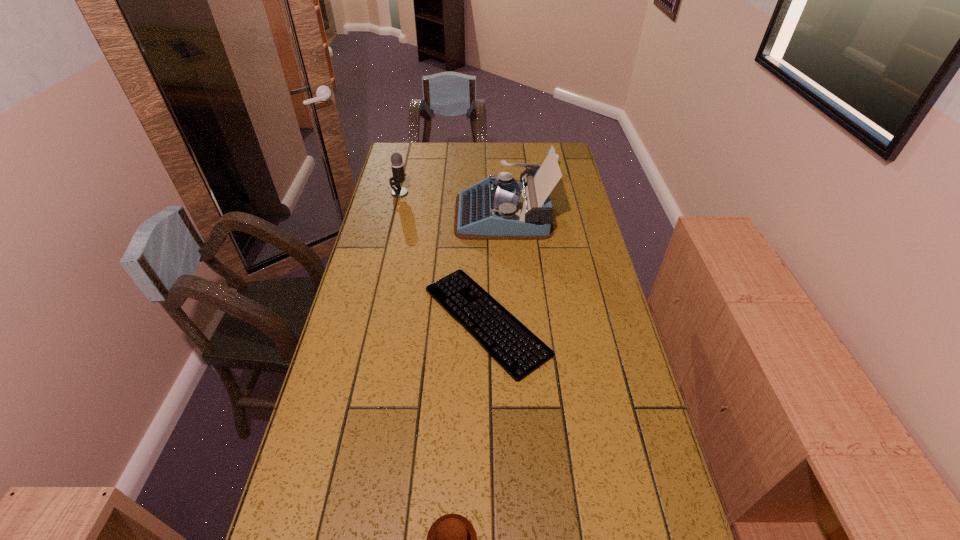
The width and height of the screenshot is (960, 540). In order to click on typewriter in this screenshot , I will do `click(501, 208)`.

Identify the location of the leftmost object. (397, 165).

Locate an element on the screen. The image size is (960, 540). microphone is located at coordinates (397, 165).

Locate an element on the screen. The height and width of the screenshot is (540, 960). the right muffin is located at coordinates (557, 156).

Identify the location of the third tallest object. (557, 156).

You are a GUI agent. You are given a task and a screenshot of the screen. Output one action in this format:
    pyautogui.click(x=<x>, y=<y>)
    Task: Click on the fourth farthest object
    
    Given the screenshot: What is the action you would take?
    pyautogui.click(x=496, y=338)

Where is `computer keyboard`? computer keyboard is located at coordinates (496, 338).

Locate an element on the screen. Image resolution: width=960 pixels, height=540 pixels. vacant space positioned 0.200m on the typing side of the typewriter is located at coordinates (404, 214).

Image resolution: width=960 pixels, height=540 pixels. I want to click on free space located 0.180m on the typing side of the typewriter, so 409,214.

Locate an element on the screen. The width and height of the screenshot is (960, 540). vacant area situated on the typing side of the typewriter is located at coordinates (381, 214).